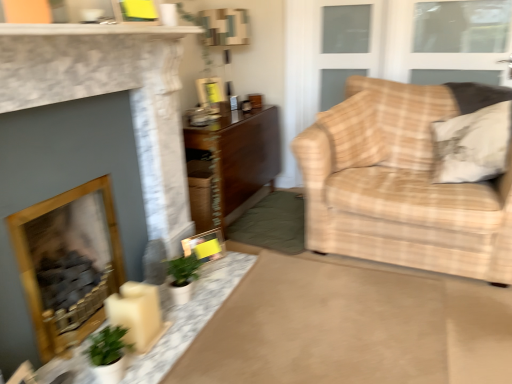
The height and width of the screenshot is (384, 512). Find the location of `free space in front of yellow paper picture frame at center, the 2th picture frame positioned from the top`. free space in front of yellow paper picture frame at center, the 2th picture frame positioned from the top is located at coordinates (211, 274).